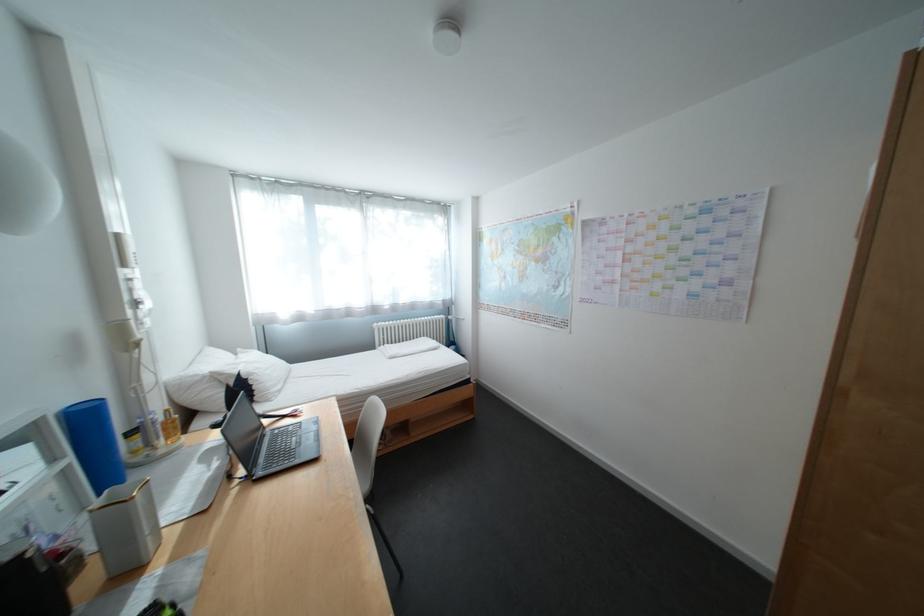
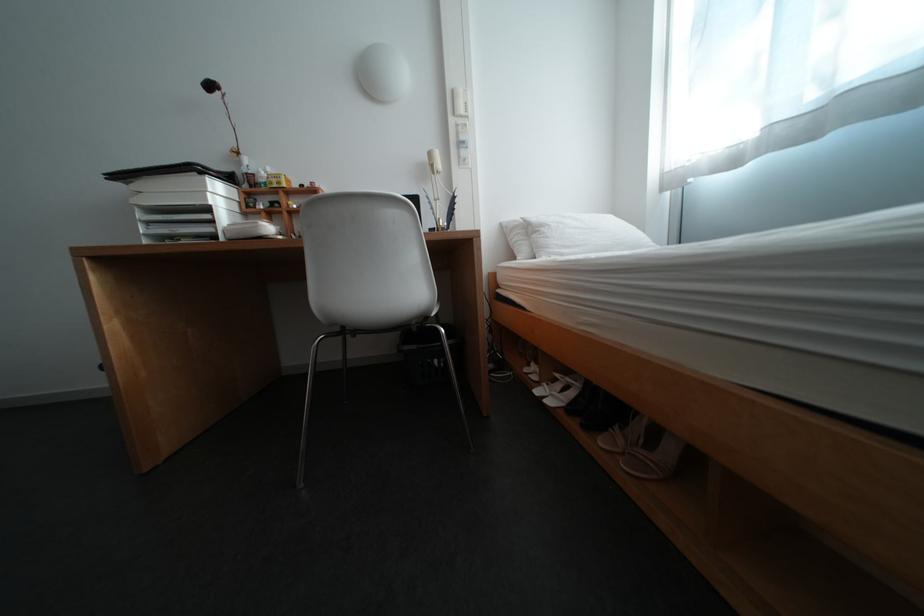
In the second image, find the point that corresponds to [129,237] in the first image.

(466, 92)